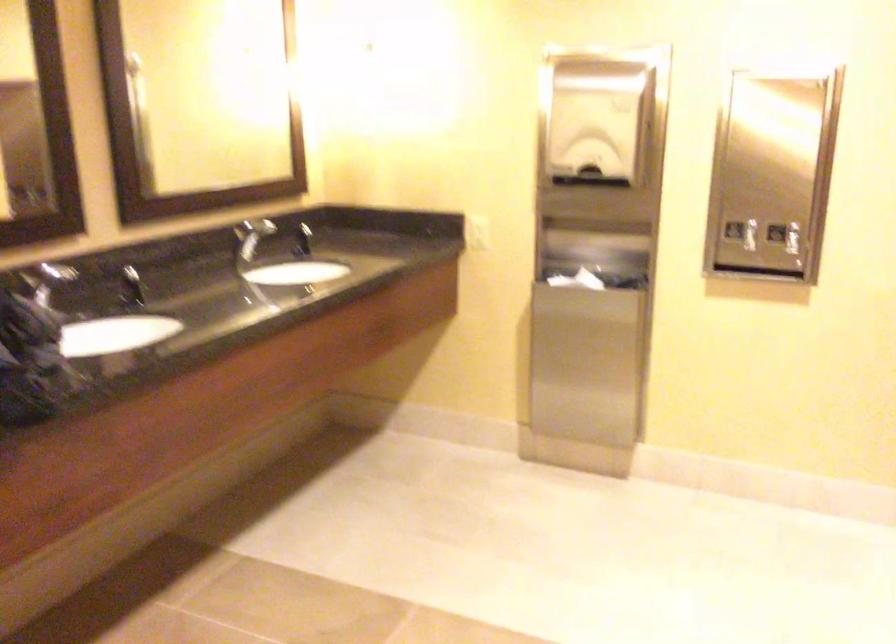
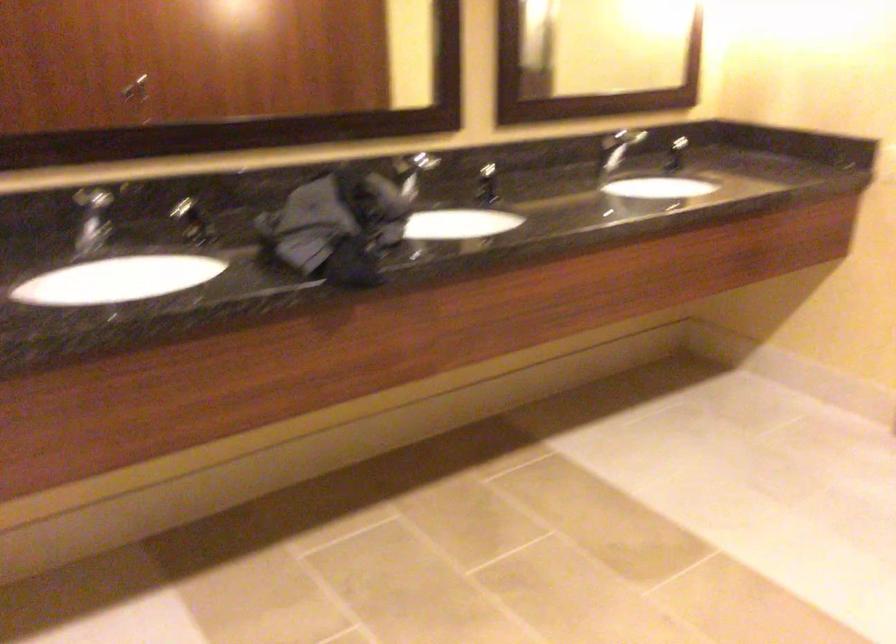
Question: The first image is from the beginning of the video and the second image is from the end. How did the camera likely rotate when shooting the video?

Choices:
 (A) Left
 (B) Right
 (C) Up
 (D) Down

Answer: (A)